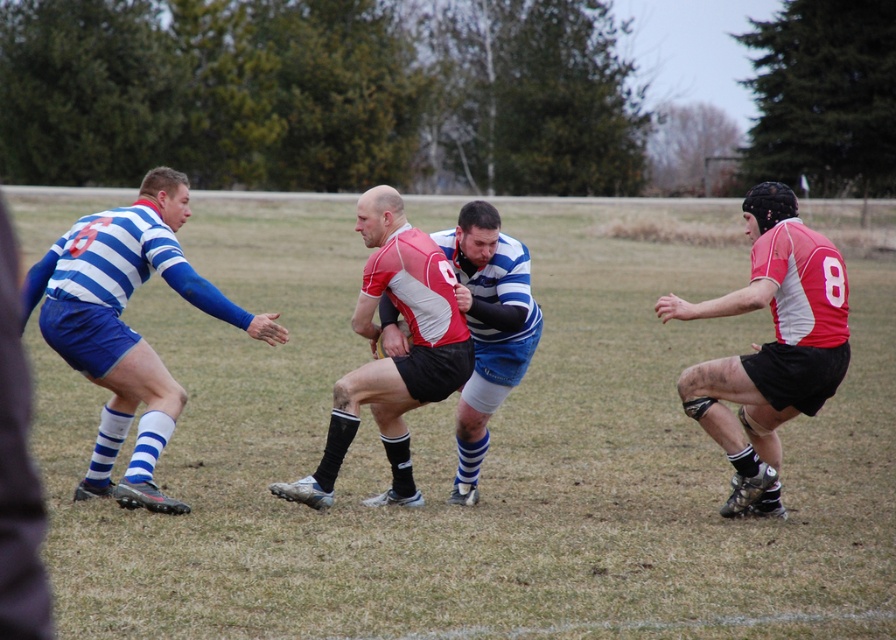
Which is behind, point (134, 278) or point (409, 252)?

The point (134, 278) is more distant.

Describe the element at coordinates (126, 326) in the screenshot. The height and width of the screenshot is (640, 896). I see `blue striped jersey at left` at that location.

Find the location of a particular element. blue striped jersey at left is located at coordinates (x=126, y=326).

Where is `blue striped jersey at left`? blue striped jersey at left is located at coordinates (126, 326).

Can you confirm if red matte jersey at right is positioned to the left of red and white jersey at center?

In fact, red matte jersey at right is to the right of red and white jersey at center.

Is red matte jersey at right thinner than red and white jersey at center?

Indeed, red matte jersey at right has a lesser width compared to red and white jersey at center.

Between point (823, 381) and point (369, 394), which one is positioned in front?

Point (823, 381) is in front.

I want to click on red matte jersey at right, so click(769, 346).

Which of these two, red matte jersey at right or white jersey at center, stands shorter?

white jersey at center

Does red matte jersey at right have a lesser width compared to white jersey at center?

Incorrect, red matte jersey at right's width is not less than white jersey at center's.

What do you see at coordinates (769, 346) in the screenshot? This screenshot has height=640, width=896. I see `red matte jersey at right` at bounding box center [769, 346].

Identify the location of red matte jersey at right. Image resolution: width=896 pixels, height=640 pixels. (769, 346).